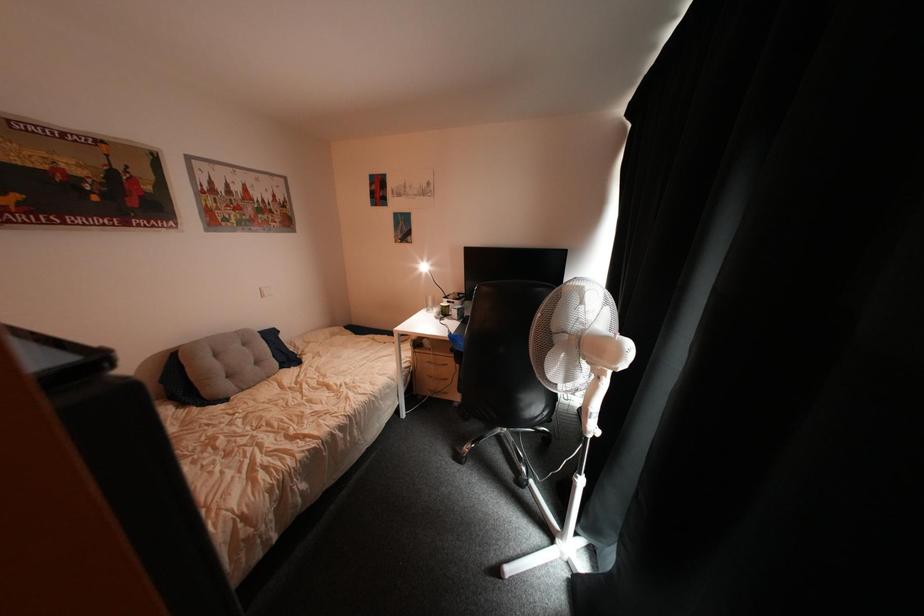
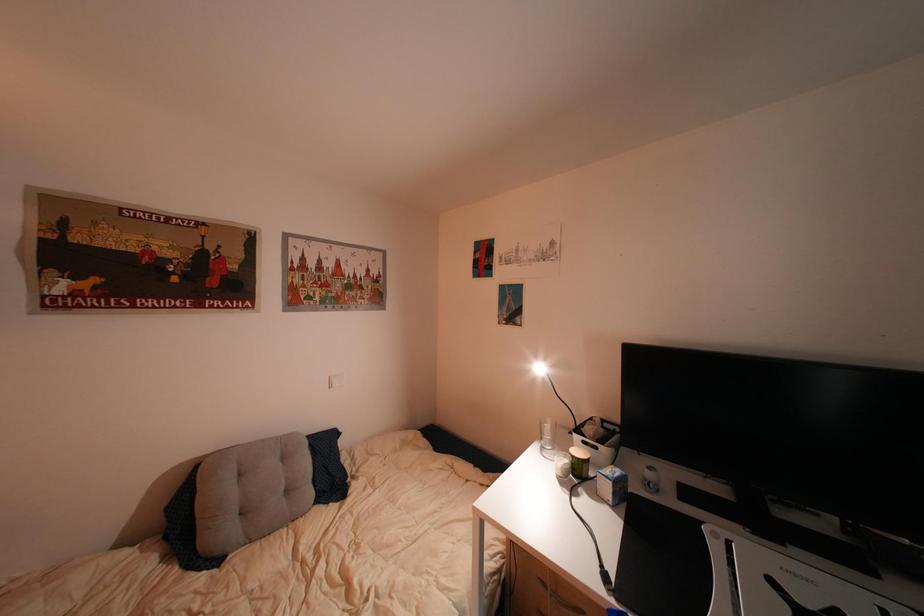
Question: The images are taken continuously from a first-person perspective. In which direction are you moving?

Choices:
 (A) Left
 (B) Right
 (C) Forward
 (D) Backward

Answer: (C)